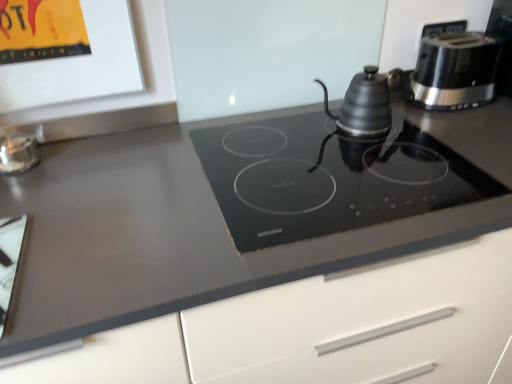
This screenshot has width=512, height=384. I want to click on vacant region in front of matte black kettle at upper right, the 2th kitchen appliance positioned from the right, so click(x=386, y=159).